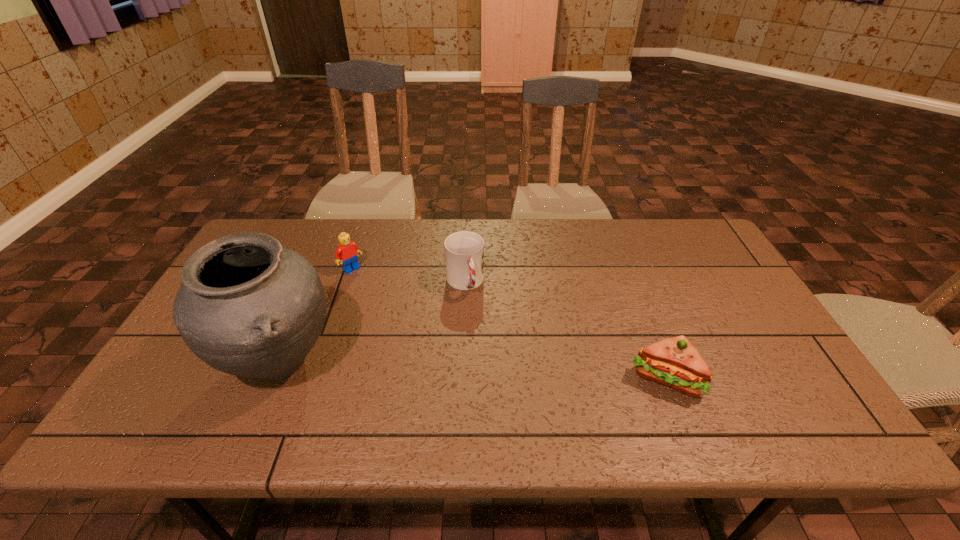
This screenshot has height=540, width=960. In order to click on object that is the second closest to the sandwich in this screenshot , I will do `click(249, 307)`.

Image resolution: width=960 pixels, height=540 pixels. I want to click on the closest object to the tallest object, so click(347, 252).

You are a GUI agent. You are given a task and a screenshot of the screen. Output one action in this format:
    pyautogui.click(x=<x>, y=<y>)
    Task: Click on the vacant space that satisfies the following two spatial constraints: 1. on the front side of the sandwich; 2. on the right side of the cup
    
    Given the screenshot: What is the action you would take?
    pyautogui.click(x=462, y=378)